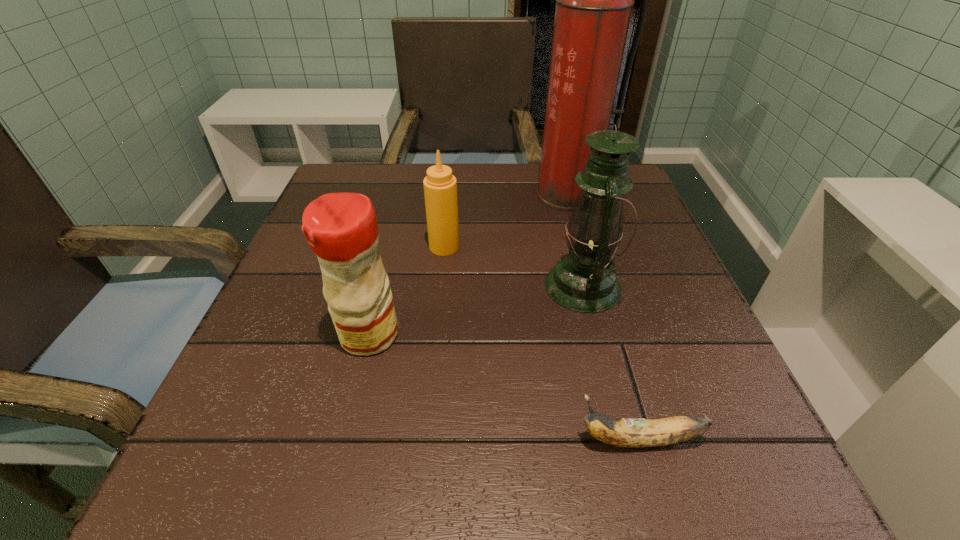
At what (x,y) coordinates should I click in order to perform the action: click on free space located 0.230m on the back of the oil lamp. Please return your answer as a coordinate pair (x, y). Looking at the image, I should click on (561, 198).

The width and height of the screenshot is (960, 540). Identify the location of vacant space located 0.120m on the back of the leftmost object. (385, 268).

Where is `free spot located on the back of the second shortest object`? Image resolution: width=960 pixels, height=540 pixels. free spot located on the back of the second shortest object is located at coordinates (451, 174).

Find the location of a particular element. The height and width of the screenshot is (540, 960). free space located at the stem of the shortest object is located at coordinates (501, 440).

At what (x,y) coordinates should I click in order to perform the action: click on free location located 0.180m at the stem of the shortest object. Please return your answer as a coordinate pair (x, y). This screenshot has width=960, height=540. Looking at the image, I should click on (443, 440).

What are the coordinates of `vacant region located 0.050m at the stem of the shortest object` in the screenshot? It's located at (539, 440).

Locate an element on the screen. This screenshot has width=960, height=540. object that is at the far edge is located at coordinates (594, 0).

This screenshot has width=960, height=540. I want to click on object that is at the near edge, so click(x=625, y=432).

This screenshot has height=540, width=960. In order to click on object at the left edge in this screenshot , I will do `click(341, 229)`.

The image size is (960, 540). Identify the location of fire extinguisher at the right edge. (594, 0).